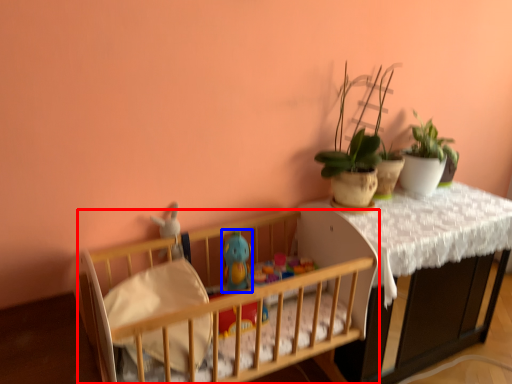
Question: Which object is further to the camera taking this photo, infant bed (highlighted by a red box) or toy (highlighted by a blue box)?

Choices:
 (A) infant bed
 (B) toy

Answer: (B)